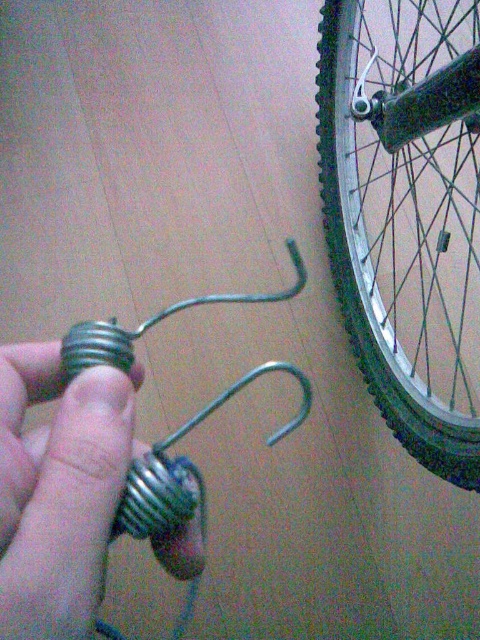
Is point (468, 237) positioned after point (99, 490)?

Yes, point (468, 237) is behind point (99, 490).

Can you confirm if metallic silver wheel at right is wider than metallic silver hook at lower left?

Yes.

The width and height of the screenshot is (480, 640). What do you see at coordinates (407, 212) in the screenshot?
I see `metallic silver wheel at right` at bounding box center [407, 212].

This screenshot has width=480, height=640. I want to click on metallic silver wheel at right, so click(407, 212).